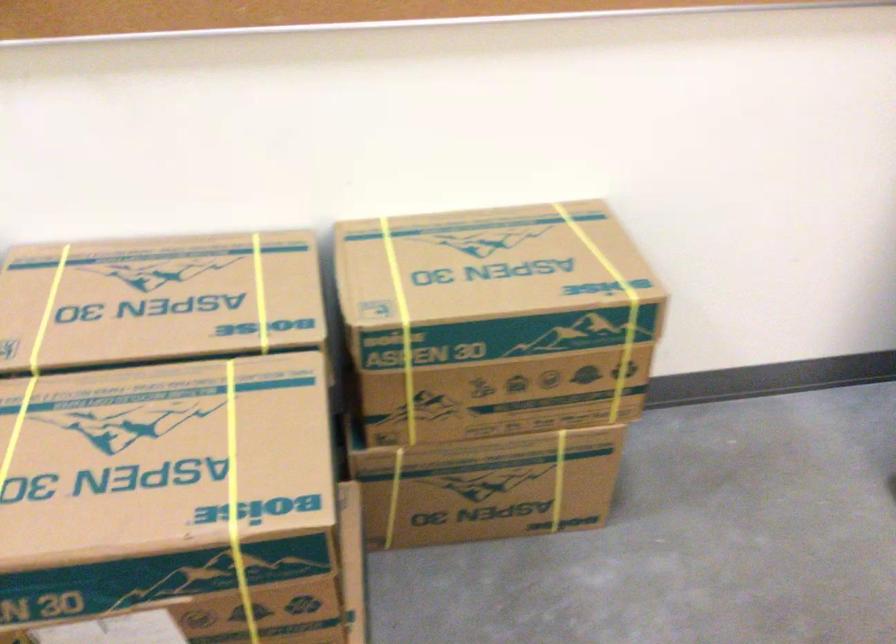
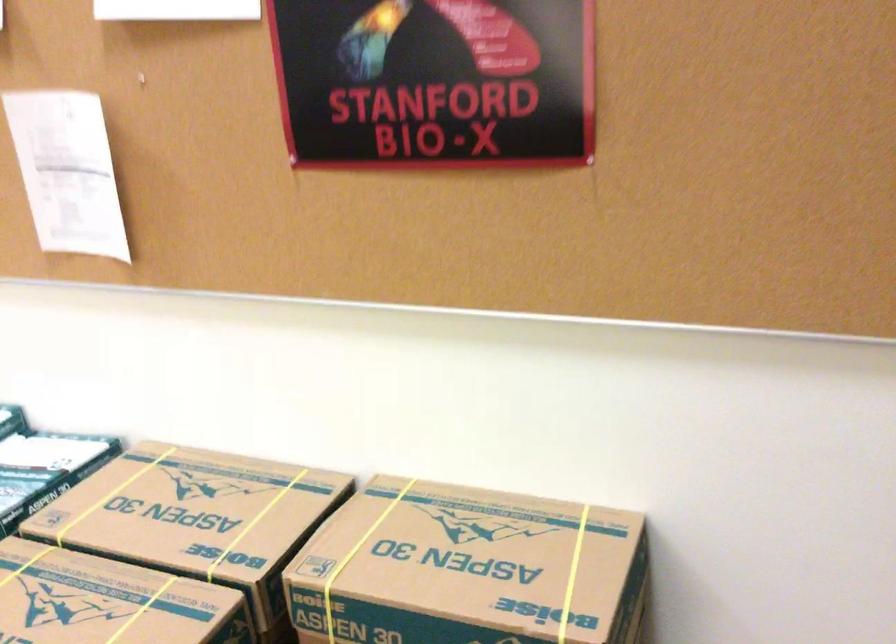
Question: The first image is from the beginning of the video and the second image is from the end. How did the camera likely rotate when shooting the video?

Choices:
 (A) Left
 (B) Right
 (C) Up
 (D) Down

Answer: (A)